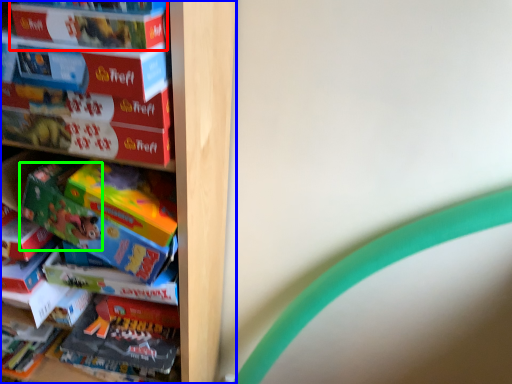
Question: Which object is positioned farthest from paperback book (highlighted by a red box)? Select from shelf (highlighted by a blue box) and toy (highlighted by a green box).

Choices:
 (A) shelf
 (B) toy

Answer: (A)